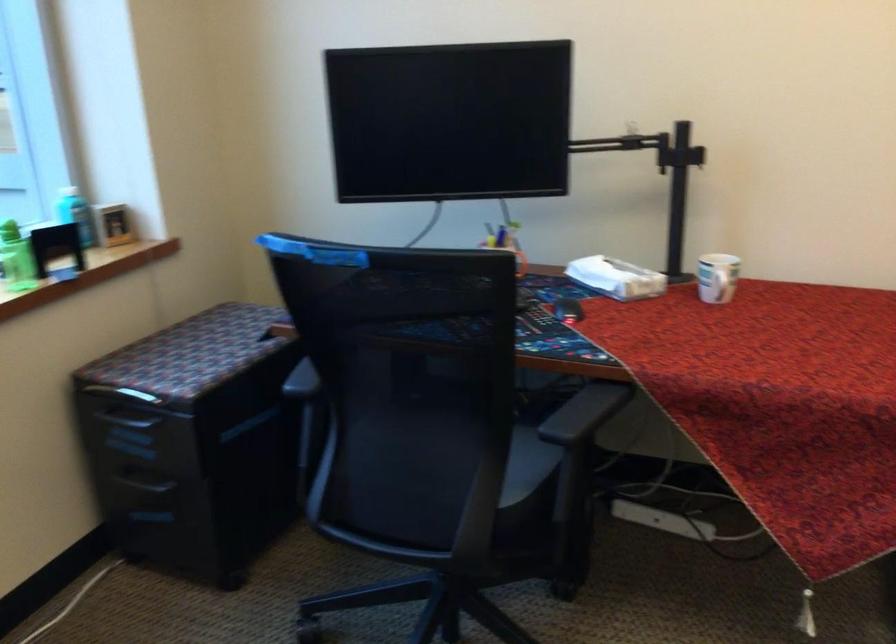
Which object does [616,278] point to?

It refers to a white tissue box.